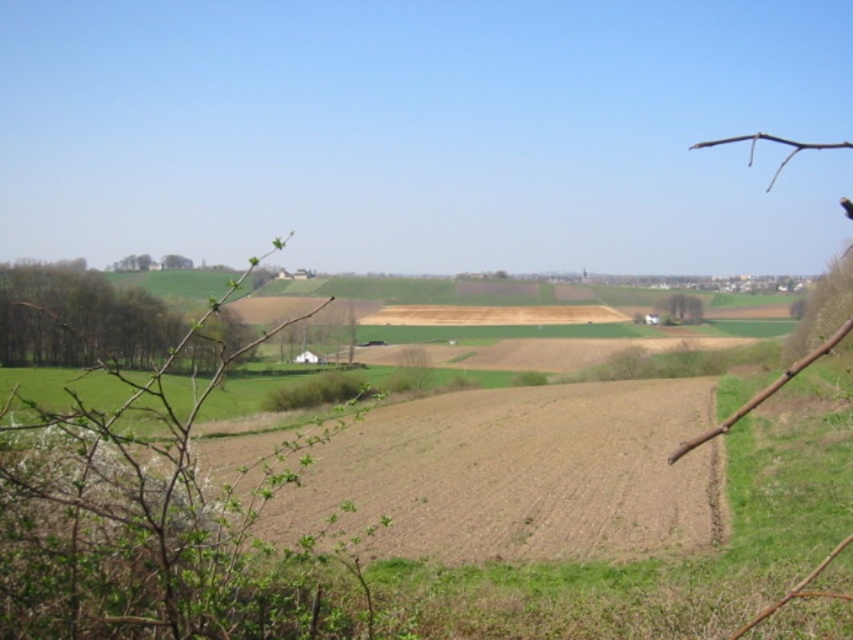
You are standing in the rural landscape shown in the image. You notice a green leafy branch at left. Can you determine its exact location using the coordinate system provided?

The green leafy branch at left is located at point coordinates (x=158, y=525).

You are a farmer assessing your land. You have a seed packet that requires planting in an area larger than the green leafy tree at right. Can the brown soil at center accommodate this requirement?

The brown soil at center is bigger than the green leafy tree at right, so yes, the brown soil at center can accommodate the seed packet requirement.

You are a gardener planning to plant a new tree in your backyard. You observe the green leafy branch at left and the green leafy tree at right in the image. Which of these two would likely require more space to grow properly?

The green leafy branch at left would likely require more space to grow properly since it is much taller than the green leafy tree at right.